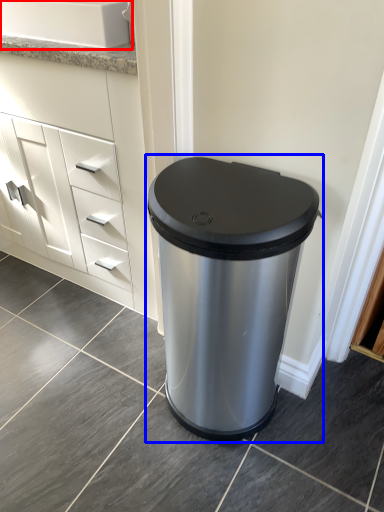
Question: Among these objects, which one is farthest to the camera, sink (highlighted by a red box) or waste container (highlighted by a blue box)?

Choices:
 (A) sink
 (B) waste container

Answer: (A)